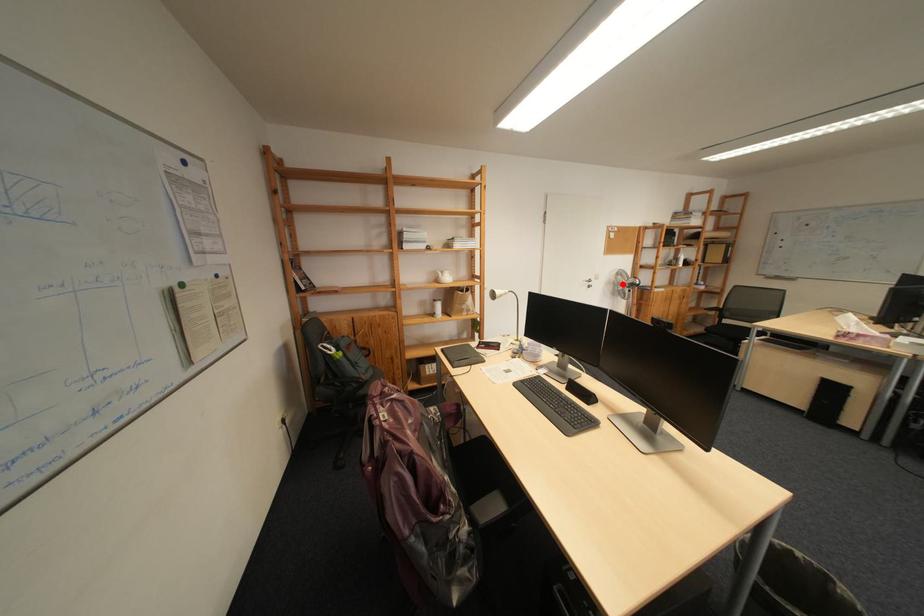
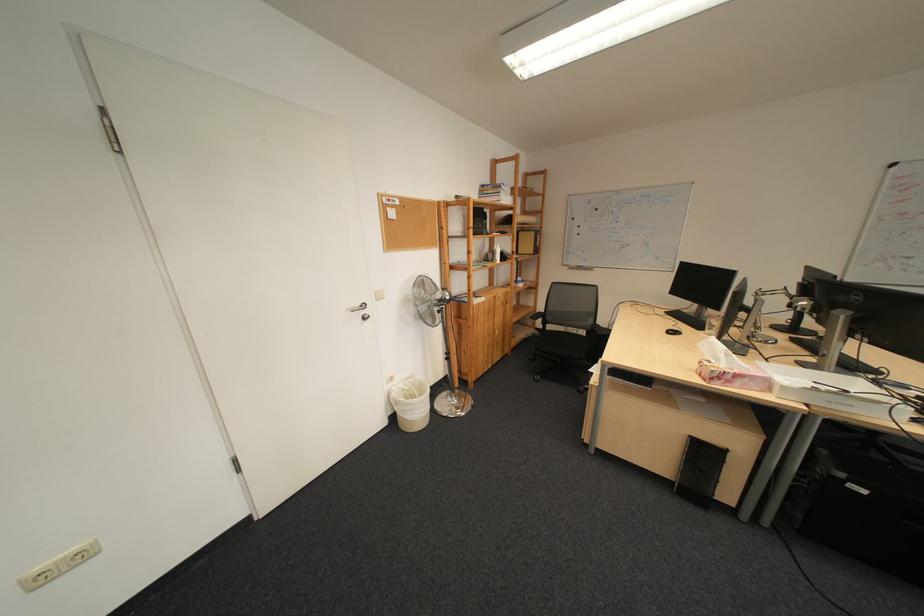
Where in the second image is the point corresponding to the highlighted location from the first image?

(419, 302)